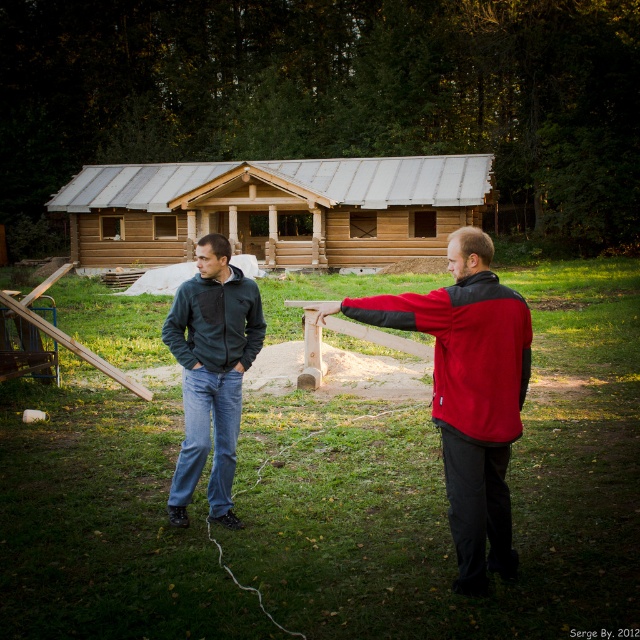
You are a hiker who has just arrived at a grassy area near a partially constructed wooden structure. You see the wooden log cabin at center and the red fleece jacket at center. Which object is positioned higher in the image?

The wooden log cabin at center is located above the red fleece jacket at center, so the wooden log cabin at center is positioned higher in the image.

You are standing in the middle of the green grass at center and want to walk towards the wooden log cabin at center. Which direction should you head?

The green grass at center is positioned on the right side of wooden log cabin at center, so to walk towards the wooden log cabin at center, you should head to the left.